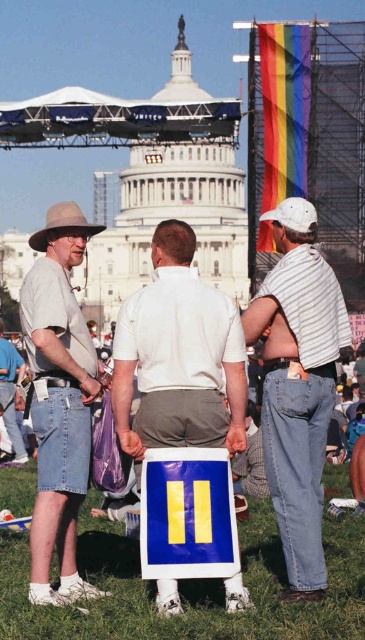
You are a photographer at the United States Capitol gathering. You want to take a photo of the white matte sign at center and the brown felt cowboy hat at left. Which object will appear larger in the photo?

The white matte sign at center appears larger in the photo because it is closer to the photographer than the brown felt cowboy hat at left.

You are a photographer planning to take a photo of the white matte sign at center and the brown felt cowboy hat at left. Based on their sizes in the image, which object should you focus on first if you want to ensure both are in frame without moving the camera?

The white matte sign at center is much taller than the brown felt cowboy hat at left, so you should focus on the white matte sign at center first to ensure it fits within the frame, as it requires more space vertically.

You are a photographer at the Capitol gathering. You see the denim shorts at left and the brown felt cowboy hat at left. Which one is positioned more to the right?

The denim shorts at left is to the right of the brown felt cowboy hat at left, so the denim shorts at left is positioned more to the right.